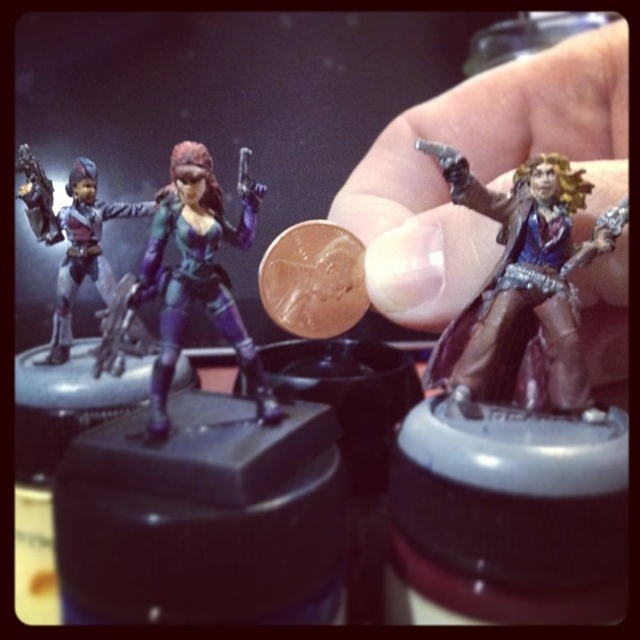
Does point (196, 236) come closer to viewer compared to point (90, 164)?

Yes, it is in front of point (90, 164).

Is matte purple figure at center thinner than matte black figure at center?

Yes, matte purple figure at center is thinner than matte black figure at center.

Does point (170, 227) come behind point (56, 328)?

That is False.

Locate an element on the screen. The width and height of the screenshot is (640, 640). matte purple figure at center is located at coordinates (196, 272).

Who is taller, brown leather glove at upper center or matte purple figure at center?

→ Standing taller between the two is brown leather glove at upper center.

Can you confirm if brown leather glove at upper center is shorter than matte purple figure at center?

No, brown leather glove at upper center is not shorter than matte purple figure at center.

Who is more distant from viewer, (390, 310) or (179, 196)?

The point (390, 310) is behind.

This screenshot has height=640, width=640. I want to click on brown leather glove at upper center, so click(x=476, y=161).

How far apart are shiny brown coat at center right and matte purple figure at center?

shiny brown coat at center right and matte purple figure at center are 8.31 inches apart from each other.

Who is positioned more to the left, shiny brown coat at center right or matte purple figure at center?

Positioned to the left is matte purple figure at center.

Does point (500, 288) lie behind point (157, 273)?

Yes, point (500, 288) is behind point (157, 273).

Where is `shiny brown coat at center right`? shiny brown coat at center right is located at coordinates click(522, 285).